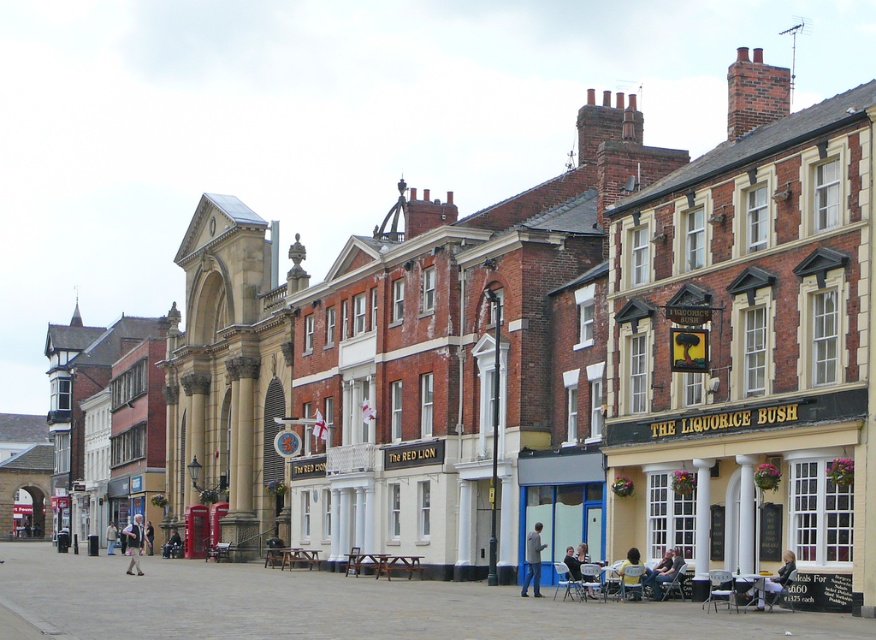
Does point (786, 262) come closer to viewer compared to point (132, 528)?

Yes.

Between yellow matte pub at center and light brown leather jacket at lower left, which one is positioned higher?

yellow matte pub at center is above.

Find the location of a particular element. The image size is (876, 640). yellow matte pub at center is located at coordinates (750, 477).

Can you confirm if yellow matte pub at center is thinner than yellow fabric chair at lower center?

In fact, yellow matte pub at center might be wider than yellow fabric chair at lower center.

Is yellow matte pub at center bigger than yellow fabric chair at lower center?

Yes, yellow matte pub at center is bigger than yellow fabric chair at lower center.

Is point (646, 448) in front of point (627, 556)?

No, (646, 448) is behind (627, 556).

Locate an element on the screen. yellow matte pub at center is located at coordinates (750, 477).

Is yellow matte pub at center to the right of light blue jeans at lower right from the viewer's perspective?

Incorrect, yellow matte pub at center is not on the right side of light blue jeans at lower right.

Does point (846, 595) come behind point (783, 556)?

No, (846, 595) is closer to viewer.

You are a GUI agent. You are given a task and a screenshot of the screen. Output one action in this format:
    pyautogui.click(x=<x>, y=<y>)
    Task: Click on the yellow matte pub at center
    This screenshot has height=640, width=876.
    Given the screenshot: What is the action you would take?
    pyautogui.click(x=750, y=477)